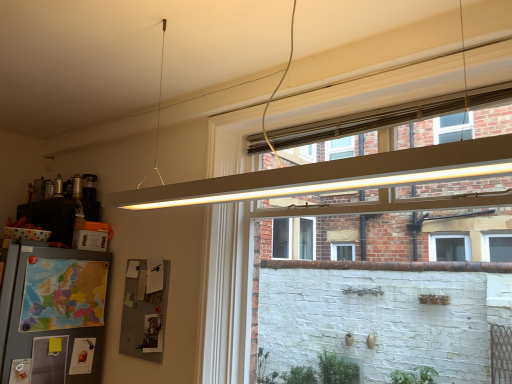
At what (x,y) coordinates should I click in order to perform the action: click on matte white frame at upper center. Please return your answer as a coordinate pair (x, y). The image size is (512, 384). Looking at the image, I should click on pos(243,281).

What do you see at coordinates (243, 281) in the screenshot? I see `matte white frame at upper center` at bounding box center [243, 281].

Locate an element on the screen. The height and width of the screenshot is (384, 512). gray fabric bulletin board at lower left is located at coordinates (144, 309).

Describe the element at coordinates (144, 309) in the screenshot. I see `gray fabric bulletin board at lower left` at that location.

The height and width of the screenshot is (384, 512). Identify the location of matte white frame at upper center. (243, 281).

Is gray fabric bulletin board at lower left at the right side of matte white frame at upper center?

Incorrect, gray fabric bulletin board at lower left is not on the right side of matte white frame at upper center.

Who is more distant, gray fabric bulletin board at lower left or matte white frame at upper center?

gray fabric bulletin board at lower left is further away from the camera.

Does point (158, 265) lie in front of point (218, 147)?

That is False.

From the image's perspective, is gray fabric bulletin board at lower left above matte white frame at upper center?

No.

From a real-world perspective, which object stands above the other?

In real-world perspective, matte white frame at upper center is above.

Which object is wider, gray fabric bulletin board at lower left or matte white frame at upper center?

matte white frame at upper center.

Looking at this image, does gray fabric bulletin board at lower left have a lesser height compared to matte white frame at upper center?

Yes.

In terms of size, does gray fabric bulletin board at lower left appear bigger or smaller than matte white frame at upper center?

In the image, gray fabric bulletin board at lower left appears to be smaller than matte white frame at upper center.

Choose the correct answer: Is gray fabric bulletin board at lower left inside matte white frame at upper center or outside it?

gray fabric bulletin board at lower left cannot be found inside matte white frame at upper center.

Are gray fabric bulletin board at lower left and matte white frame at upper center beside each other?

No.

Is gray fabric bulletin board at lower left turned away from matte white frame at upper center?

gray fabric bulletin board at lower left is not turned away from matte white frame at upper center.

How different are the orientations of gray fabric bulletin board at lower left and matte white frame at upper center in degrees?

0.715 degrees.

Image resolution: width=512 pixels, height=384 pixels. I want to click on bulletin board behind the matte white frame at upper center, so click(x=144, y=309).

In the image, is matte white frame at upper center on the left side or the right side of gray fabric bulletin board at lower left?

In the image, matte white frame at upper center appears on the right side of gray fabric bulletin board at lower left.

Does matte white frame at upper center come in front of gray fabric bulletin board at lower left?

Yes.

Considering the points (234, 304) and (165, 306), which point is in front, point (234, 304) or point (165, 306)?

Point (234, 304)

From the image's perspective, is matte white frame at upper center on gray fabric bulletin board at lower left?

Yes, from the image's perspective, matte white frame at upper center is over gray fabric bulletin board at lower left.

From a real-world perspective, is matte white frame at upper center physically located above or below gray fabric bulletin board at lower left?

matte white frame at upper center is above gray fabric bulletin board at lower left.

Is matte white frame at upper center thinner than gray fabric bulletin board at lower left?

In fact, matte white frame at upper center might be wider than gray fabric bulletin board at lower left.

Is matte white frame at upper center taller or shorter than gray fabric bulletin board at lower left?

matte white frame at upper center is taller than gray fabric bulletin board at lower left.

Between matte white frame at upper center and gray fabric bulletin board at lower left, which one has larger size?

Bigger between the two is matte white frame at upper center.

Would you say matte white frame at upper center is outside gray fabric bulletin board at lower left?

Indeed, matte white frame at upper center is completely outside gray fabric bulletin board at lower left.

From the picture: Are matte white frame at upper center and gray fabric bulletin board at lower left far apart?

No, matte white frame at upper center is not far away from gray fabric bulletin board at lower left.

Is gray fabric bulletin board at lower left at the back of matte white frame at upper center?

No, gray fabric bulletin board at lower left is not at the back of matte white frame at upper center.

I want to click on bulletin board on the left of the matte white frame at upper center, so click(144, 309).

This screenshot has width=512, height=384. In order to click on bulletin board that appears below the matte white frame at upper center (from the image's perspective) in this screenshot , I will do `click(144, 309)`.

This screenshot has width=512, height=384. In the image, there is a matte white frame at upper center. Find the location of `bulletin board below it (from a real-world perspective)`. bulletin board below it (from a real-world perspective) is located at coordinates (144, 309).